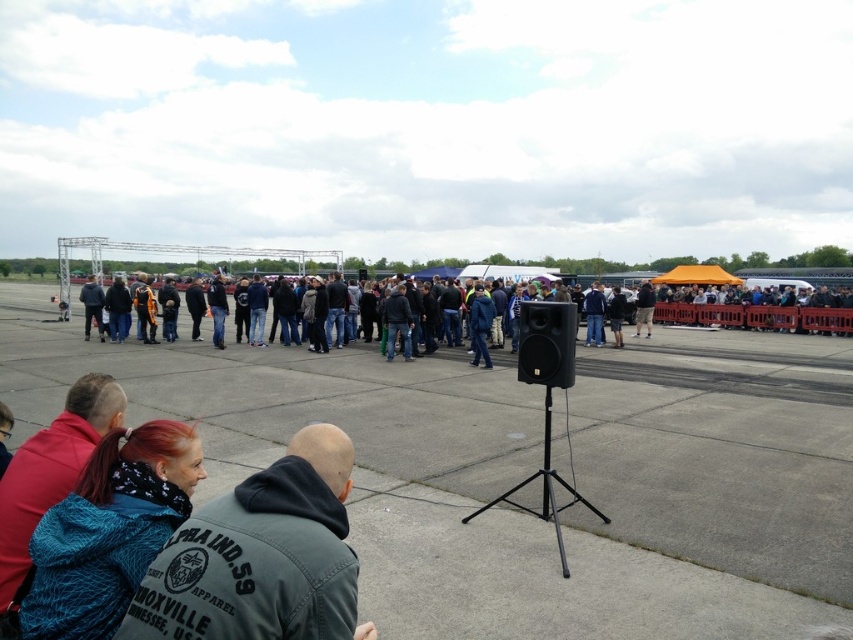
Question: Which object is closer to the camera taking this photo?

Choices:
 (A) dark gray jacket at center
 (B) dark gray hoodie at lower center
 (C) dark gray casual clothing at center
 (D) red knit sweater at lower left

Answer: (B)

Question: Based on their relative distances, which object is nearer to the dark gray casual clothing at center?

Choices:
 (A) teal textured jacket at lower left
 (B) red knit sweater at lower left

Answer: (A)

Question: Can you confirm if teal textured jacket at lower left is positioned to the right of red knit sweater at lower left?

Choices:
 (A) yes
 (B) no

Answer: (A)

Question: Which object is closer to the camera taking this photo?

Choices:
 (A) teal textured jacket at lower left
 (B) dark gray casual clothing at center

Answer: (A)

Question: Can you confirm if gray concrete tarmac at center is positioned to the left of dark gray jacket at center?

Choices:
 (A) yes
 (B) no

Answer: (A)

Question: Does dark gray hoodie at lower center appear on the right side of teal textured jacket at lower left?

Choices:
 (A) yes
 (B) no

Answer: (A)